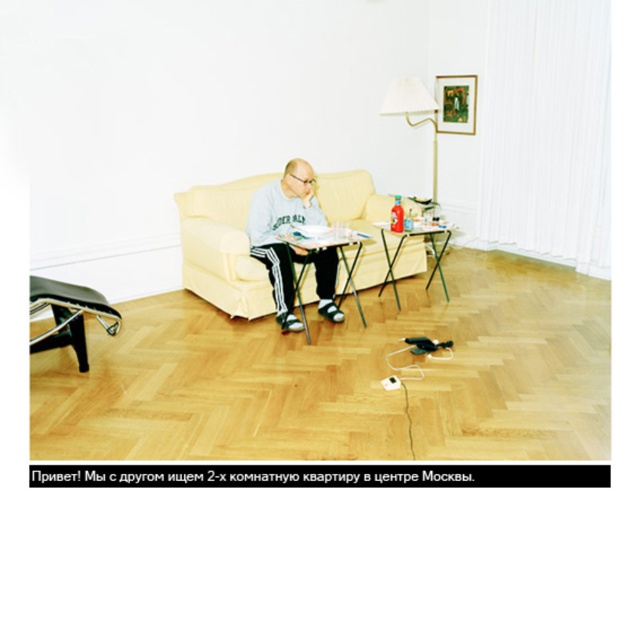
Looking at this image, you are a delivery person trying to place a large package that is 2 meters long in the living room. The package needs to be placed between the wooden folding table at center and the white fabric lampshade at upper center. Is there enough space to fit the package horizontally between them?

The wooden folding table at center and the white fabric lampshade at upper center are 1.99 meters apart. Since the package is 2 meters long, which is slightly longer than the available space, it will not fit horizontally between them.

You are standing in the living room and want to place a 4 meter long ladder on the floor. Can the wooden folding table at center be used as a support for the ladder?

The wooden folding table at center is only 3.52 meters away from the camera, which is shorter than the ladder. Therefore, it cannot be used as a support for the ladder.

You are a person in the living room. You want to place a small object exactly at the point with coordinates point (221, 248). Is that point on the beige fabric couch at center?

Yes, the point (221, 248) is on the beige fabric couch at center, so placing the object there would be possible.